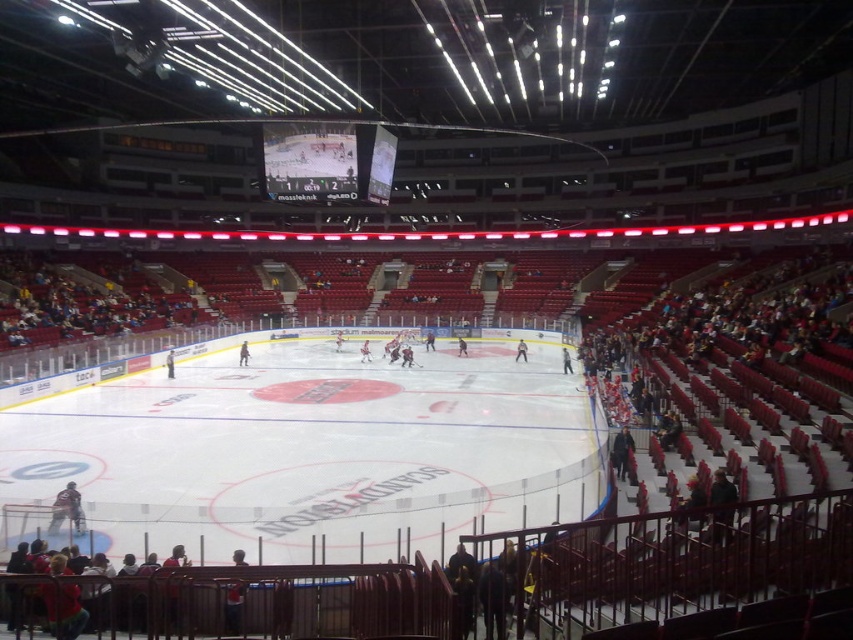
You are a spectator standing at the edge of the arena. You notice the white smooth ice at center and the matte digital scoreboard at center. Which object is higher in elevation from your viewpoint?

The white smooth ice at center is taller than the matte digital scoreboard at center, so the white smooth ice at center is higher in elevation from your viewpoint.

Looking at this image, you are an arena manager checking the layout. The white smooth ice at center and the matte digital scoreboard at center are both at the center of the arena. Which one has a greater width?

The white smooth ice at center has a greater width than the matte digital scoreboard at center according to the description.